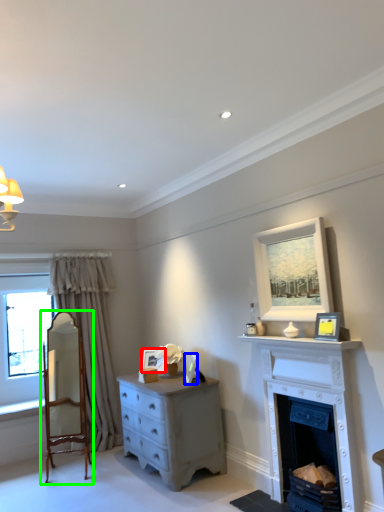
Question: Considering the real-world distances, which object is farthest from picture frame (highlighted by a red box)? picture frame (highlighted by a blue box) or chair (highlighted by a green box)?

Choices:
 (A) picture frame
 (B) chair

Answer: (B)